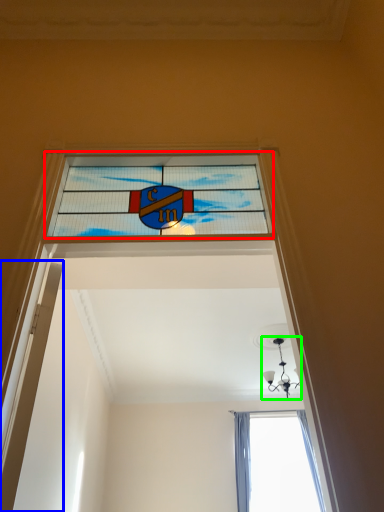
Question: Which is nearer to the window (highlighted by a red box)? door (highlighted by a blue box) or light fixture (highlighted by a green box).

Choices:
 (A) door
 (B) light fixture

Answer: (A)